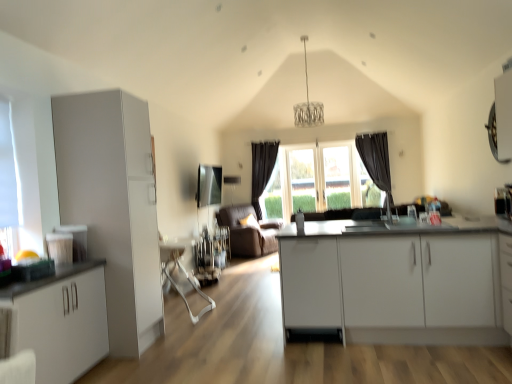
Question: Is white matte cabinet at center, the first cabinetry in the right-to-left sequence, taller than dark fabric curtain at center, which is counted as the 1th curtain, starting from the back?

Choices:
 (A) yes
 (B) no

Answer: (B)

Question: Can you confirm if white matte cabinet at center, the first cabinetry in the right-to-left sequence, is smaller than dark fabric curtain at center, which is counted as the 1th curtain, starting from the left?

Choices:
 (A) no
 (B) yes

Answer: (A)

Question: Is white matte cabinet at center, the third cabinetry from the left, positioned before dark fabric curtain at center, acting as the 2th curtain starting from the right?

Choices:
 (A) no
 (B) yes

Answer: (B)

Question: Considering the relative positions of white matte cabinet at center, the third cabinetry from the left, and dark fabric curtain at center, acting as the 2th curtain starting from the right, in the image provided, is white matte cabinet at center, the third cabinetry from the left, to the right of dark fabric curtain at center, acting as the 2th curtain starting from the right, from the viewer's perspective?

Choices:
 (A) no
 (B) yes

Answer: (B)

Question: Is dark fabric curtain at center, acting as the 2th curtain starting from the right, inside white matte cabinet at center, the third cabinetry from the left?

Choices:
 (A) no
 (B) yes

Answer: (A)

Question: From a real-world perspective, is transparent glass window at left, marked as the first window in a front-to-back arrangement, physically located above or below white matte cabinet at center, the first cabinetry in the right-to-left sequence?

Choices:
 (A) above
 (B) below

Answer: (A)

Question: Based on their positions, is transparent glass window at left, the 3th window from the back, located to the left or right of white matte cabinet at center, the first cabinetry in the right-to-left sequence?

Choices:
 (A) right
 (B) left

Answer: (B)

Question: Is transparent glass window at left, which ranks as the third window in right-to-left order, in front of or behind white matte cabinet at center, the first cabinetry in the right-to-left sequence, in the image?

Choices:
 (A) front
 (B) behind

Answer: (A)

Question: Choose the correct answer: Is transparent glass window at left, marked as the first window in a front-to-back arrangement, inside white matte cabinet at center, the first cabinetry in the right-to-left sequence, or outside it?

Choices:
 (A) inside
 (B) outside

Answer: (B)

Question: From a real-world perspective, is white plastic swivel chair at center above or below white matte cabinet at left, the second cabinetry in the right-to-left sequence?

Choices:
 (A) below
 (B) above

Answer: (A)

Question: Visually, is white plastic swivel chair at center positioned to the left or to the right of white matte cabinet at left, the second cabinetry in the right-to-left sequence?

Choices:
 (A) left
 (B) right

Answer: (B)

Question: Looking at the image, does white plastic swivel chair at center seem bigger or smaller compared to white matte cabinet at left, marked as the 2th cabinetry in a left-to-right arrangement?

Choices:
 (A) small
 (B) big

Answer: (A)

Question: Considering the positions of point (199, 288) and point (108, 276), is point (199, 288) closer or farther from the camera than point (108, 276)?

Choices:
 (A) farther
 (B) closer

Answer: (A)

Question: From their relative heights in the image, would you say transparent glass door at center is taller or shorter than dark grey fabric curtain at right, the second curtain in the back-to-front sequence?

Choices:
 (A) short
 (B) tall

Answer: (A)

Question: Is transparent glass door at center wider or thinner than dark grey fabric curtain at right, the first curtain positioned from the front?

Choices:
 (A) thin
 (B) wide

Answer: (A)